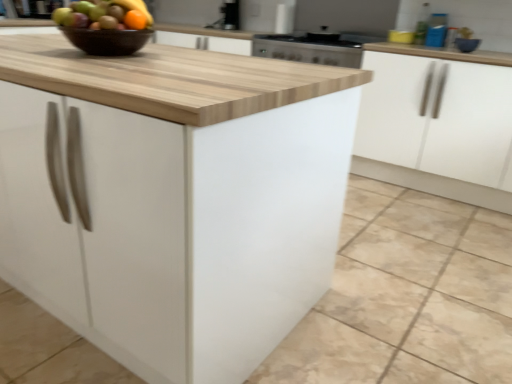
Question: Does blue glossy bowl at upper right have a larger size compared to white matte cabinet at right, placed as the first cabinetry when sorted from back to front?

Choices:
 (A) yes
 (B) no

Answer: (B)

Question: Considering the relative sizes of blue glossy bowl at upper right and white matte cabinet at right, positioned as the 2th cabinetry in front-to-back order, in the image provided, is blue glossy bowl at upper right taller than white matte cabinet at right, positioned as the 2th cabinetry in front-to-back order,?

Choices:
 (A) yes
 (B) no

Answer: (B)

Question: Is blue glossy bowl at upper right looking in the opposite direction of white matte cabinet at right, positioned as the 2th cabinetry in front-to-back order?

Choices:
 (A) yes
 (B) no

Answer: (B)

Question: Does blue glossy bowl at upper right have a smaller size compared to white matte cabinet at right, placed as the first cabinetry when sorted from back to front?

Choices:
 (A) no
 (B) yes

Answer: (B)

Question: From a real-world perspective, is blue glossy bowl at upper right below white matte cabinet at right, placed as the first cabinetry when sorted from back to front?

Choices:
 (A) no
 (B) yes

Answer: (A)

Question: Does blue glossy bowl at upper right turn towards white matte cabinet at right, placed as the first cabinetry when sorted from back to front?

Choices:
 (A) yes
 (B) no

Answer: (B)

Question: Is there a large distance between white matte cabinet at right, placed as the first cabinetry when sorted from back to front, and blue glossy bowl at upper right?

Choices:
 (A) no
 (B) yes

Answer: (A)

Question: Could blue glossy bowl at upper right be considered to be inside white matte cabinet at right, placed as the first cabinetry when sorted from back to front?

Choices:
 (A) yes
 (B) no

Answer: (B)

Question: Is the depth of white matte cabinet at right, placed as the first cabinetry when sorted from back to front, less than that of blue glossy bowl at upper right?

Choices:
 (A) yes
 (B) no

Answer: (A)

Question: Is white matte cabinet at right, placed as the first cabinetry when sorted from back to front, bigger than blue glossy bowl at upper right?

Choices:
 (A) yes
 (B) no

Answer: (A)

Question: From the image's perspective, is white matte cabinet at right, positioned as the 2th cabinetry in front-to-back order, on top of blue glossy bowl at upper right?

Choices:
 (A) no
 (B) yes

Answer: (A)

Question: Is the position of white matte cabinet at right, placed as the first cabinetry when sorted from back to front, more distant than that of blue glossy bowl at upper right?

Choices:
 (A) no
 (B) yes

Answer: (A)

Question: Is brown glossy bowl at upper center facing away from white matte cabinet at center, the second cabinetry positioned from the back?

Choices:
 (A) yes
 (B) no

Answer: (B)